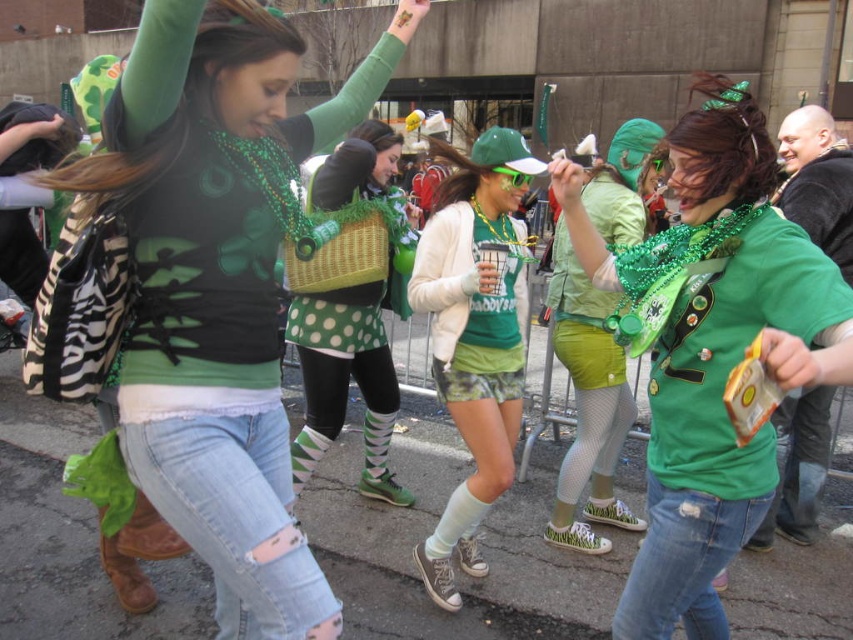
Question: Is matte black shirt at center wider than matte green shorts at center?

Choices:
 (A) yes
 (B) no

Answer: (A)

Question: Which of the following is the closest to the observer?

Choices:
 (A) polka dot leggings at center
 (B) matte green shorts at center
 (C) green matte shorts at center

Answer: (B)

Question: Is green matte shirt at center smaller than green matte shorts at center?

Choices:
 (A) yes
 (B) no

Answer: (B)

Question: Is green matte shirt at center above green matte shorts at center?

Choices:
 (A) yes
 (B) no

Answer: (B)

Question: Which of these objects is positioned closest to the matte green shorts at center?

Choices:
 (A) green matte shirt at center
 (B) green matte shorts at center
 (C) polka dot leggings at center

Answer: (C)

Question: Which of the following is the farthest from the observer?

Choices:
 (A) polka dot leggings at center
 (B) green matte shorts at center
 (C) matte green shorts at center
 (D) green matte shirt at center

Answer: (A)